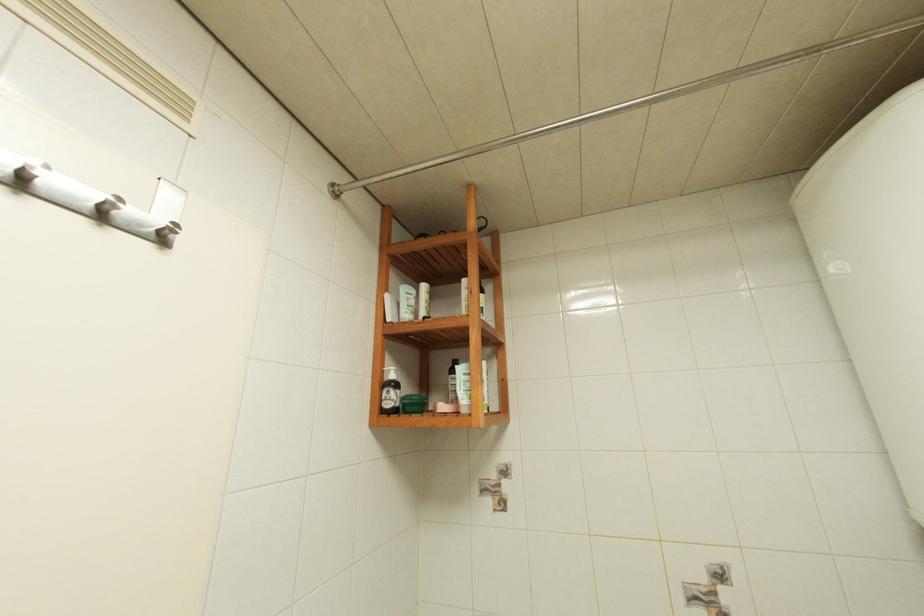
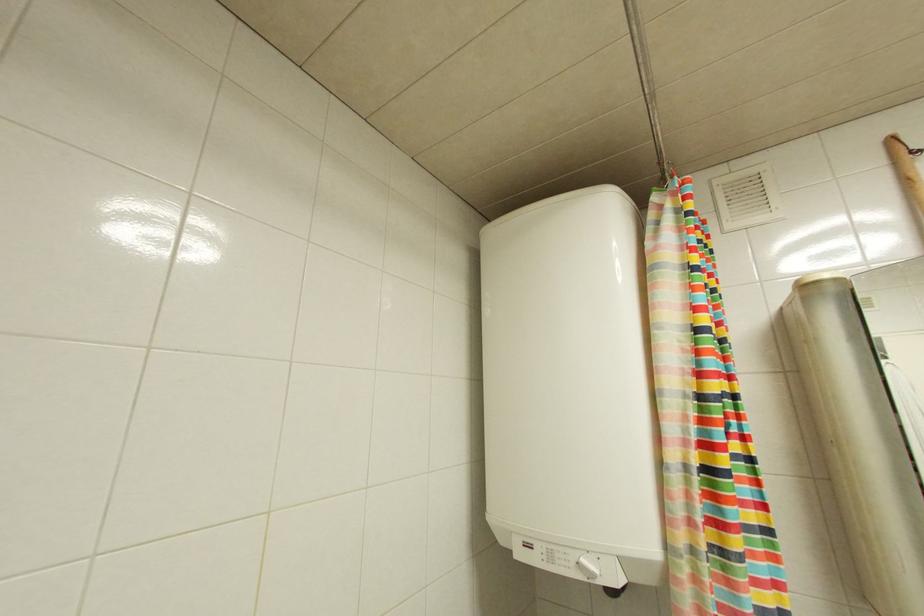
Question: The images are taken continuously from a first-person perspective. In which direction is your viewpoint rotating?

Choices:
 (A) Left
 (B) Right
 (C) Up
 (D) Down

Answer: (B)